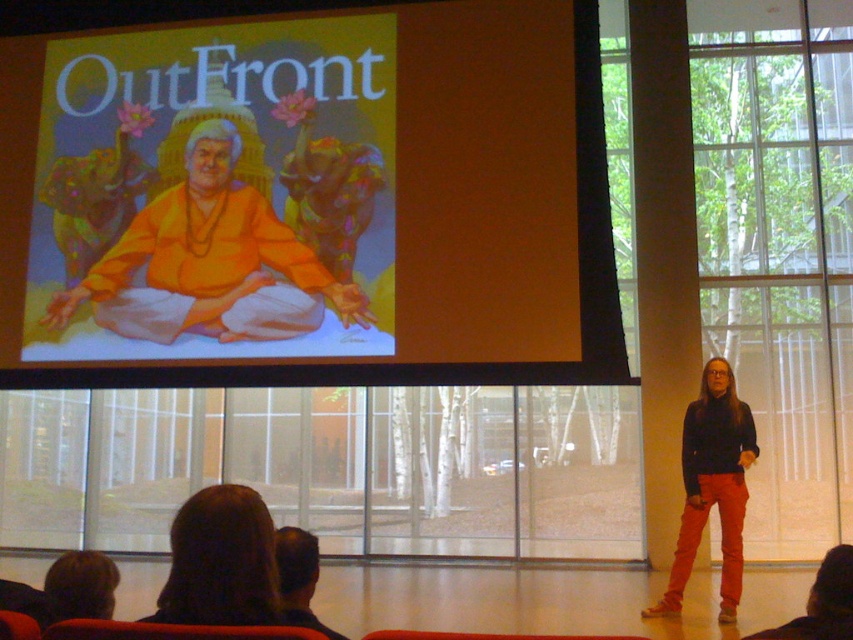
You are a photographer taking a picture of the presentation screen and the presenter. You notice two points marked on the screen. Which point is closer to your camera lens? Please choose between the point at coordinates (231, 506) and the point at (724, 372).

The point at coordinates (231, 506) is closer to the camera lens than the point at (724, 372).

You are an attendee at the presentation. You notice two elements in the image, the matte orange fabric at center and the brown hair at lower right. Which of these is positioned higher up in the image?

The matte orange fabric at center is located above brown hair at lower right, so it is positioned higher up in the image.

You are a photographer in the audience at the presentation. You want to take a photo of the two people with dark brown hair at lower left and brown hair at lower right so that both are fully visible. Can you move to a position where you can see both people without any obstruction?

dark brown hair at lower left is behind brown hair at lower right, so moving to a position where you can see around or beside brown hair at lower right would allow both to be visible in the photo.